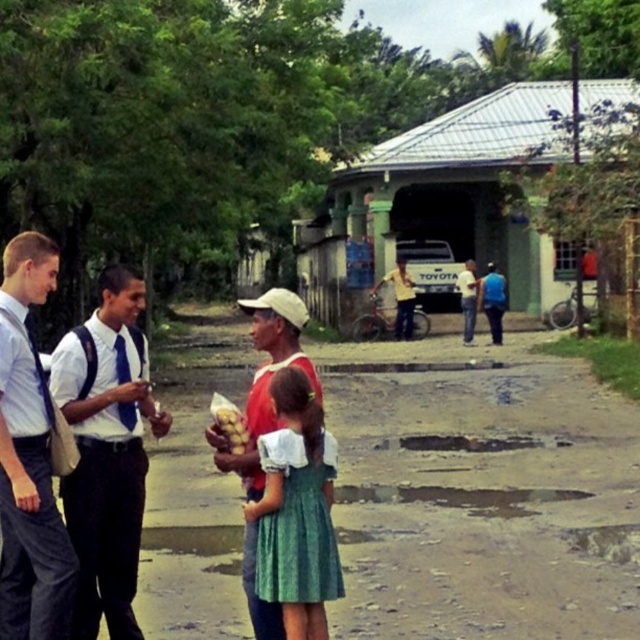
Who is shorter, brown dirt track at center or green cotton dress at center?

With less height is green cotton dress at center.

Is brown dirt track at center above green cotton dress at center?

No.

What are the coordinates of `brown dirt track at center` in the screenshot? It's located at (483, 497).

From the picture: Who is positioned more to the right, white cotton shirt at left or green textured dress at center?

Positioned to the right is white cotton shirt at left.

Based on the photo, can you confirm if white cotton shirt at left is bigger than green textured dress at center?

Incorrect, white cotton shirt at left is not larger than green textured dress at center.

Where is `white cotton shirt at left`? This screenshot has width=640, height=640. white cotton shirt at left is located at coordinates (28, 460).

Is white shirt with tie at left to the right of blue fabric shirt at center from the viewer's perspective?

Incorrect, white shirt with tie at left is not on the right side of blue fabric shirt at center.

Between white shirt with tie at left and blue fabric shirt at center, which one is positioned lower?

white shirt with tie at left is below.

Identify the location of white shirt with tie at left. (106, 452).